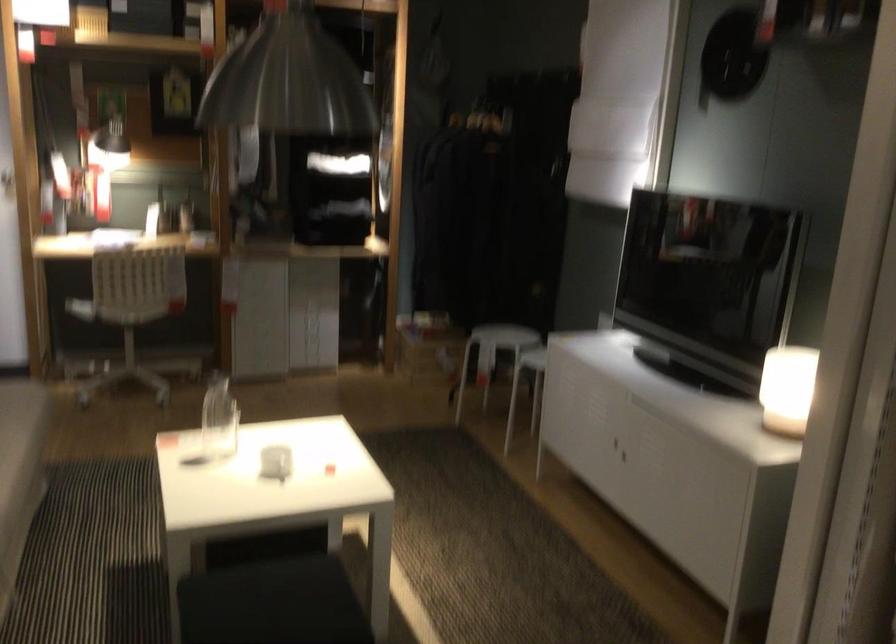
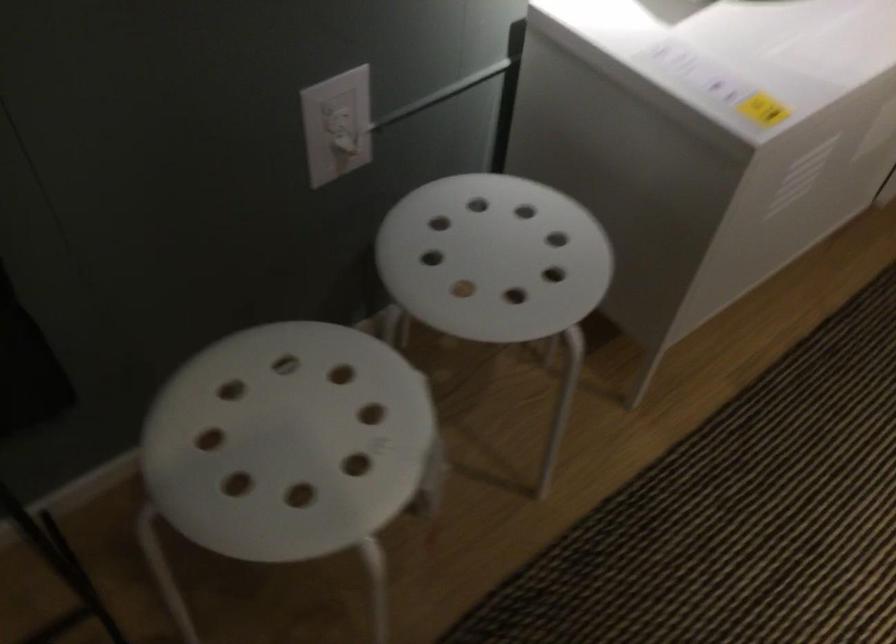
Where in the second image is the point corresponding to pixel 607 323 from the first image?

(337, 125)